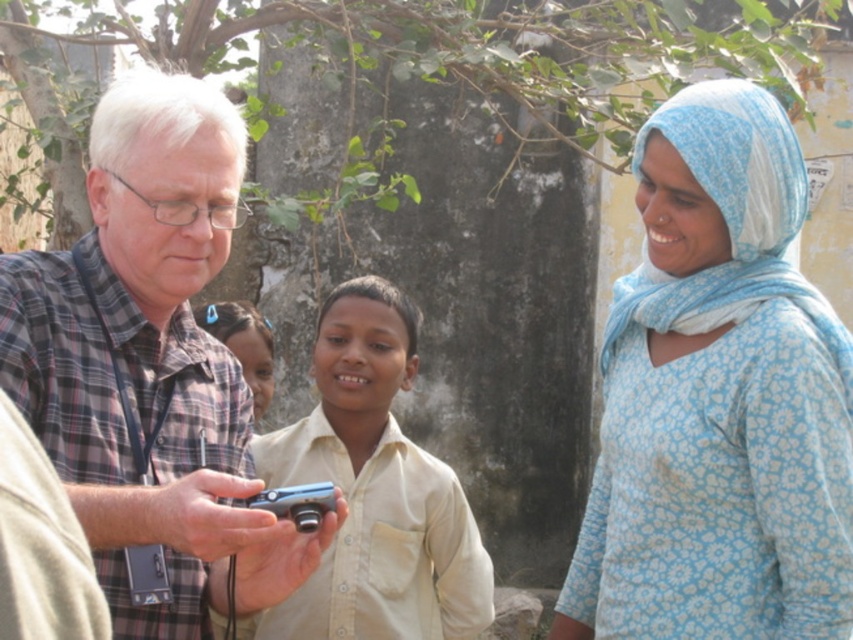
You are a photographer trying to capture a candid shot of the group. You notice the beige cotton shirt at center and the light brown hair at center. Which object should you focus on first to ensure both are in frame?

The beige cotton shirt at center is closer to the viewer than the light brown hair at center, so focusing on the beige cotton shirt at center first will help ensure both are in frame as it is nearer.